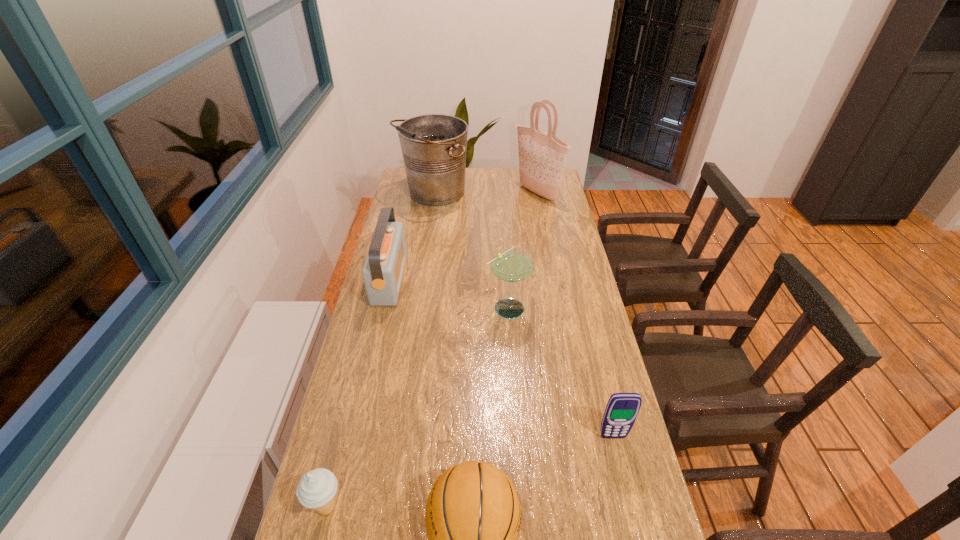
You are a GUI agent. You are given a task and a screenshot of the screen. Output one action in this format:
    pyautogui.click(x=<x>, y=<y>)
    Task: Click on the object present at the far right corner
    
    Given the screenshot: What is the action you would take?
    pyautogui.click(x=542, y=157)

This screenshot has width=960, height=540. In order to click on vacant space at the far edge of the desktop in this screenshot , I will do `click(501, 186)`.

In the image, there is a desktop. Where is `vacant space at the left edge`? The image size is (960, 540). vacant space at the left edge is located at coordinates (419, 248).

The image size is (960, 540). In the image, there is a desktop. In order to click on vacant space at the right edge in this screenshot , I will do `click(609, 450)`.

I want to click on free spot between the cellular telephone and the tallest object, so click(x=575, y=315).

At what (x,y) coordinates should I click in order to perform the action: click on free space between the shopping bag and the sixth shortest object. Please return your answer as a coordinate pair (x, y). Looking at the image, I should click on (485, 193).

This screenshot has width=960, height=540. I want to click on free spot between the second tallest object and the shopping bag, so click(x=485, y=193).

The image size is (960, 540). What are the coordinates of `free spot between the shopping bag and the radio receiver` in the screenshot? It's located at (463, 236).

In order to click on free space between the icecream and the bucket in this screenshot , I will do `click(380, 350)`.

Identify which object is located as the sixth nearest to the shopping bag. Please provide its 2D coordinates. Your answer should be formatted as a tuple, i.e. [(x, y)], where the tuple contains the x and y coordinates of a point satisfying the conditions above.

[(317, 488)]